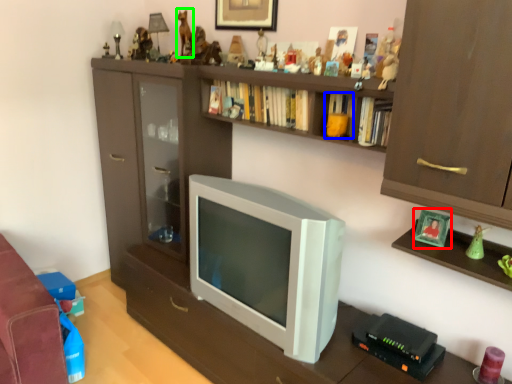
Question: Which object is positioned farthest from picture frame (highlighted by a red box)? Select from book (highlighted by a blue box) and toy (highlighted by a green box).

Choices:
 (A) book
 (B) toy

Answer: (B)